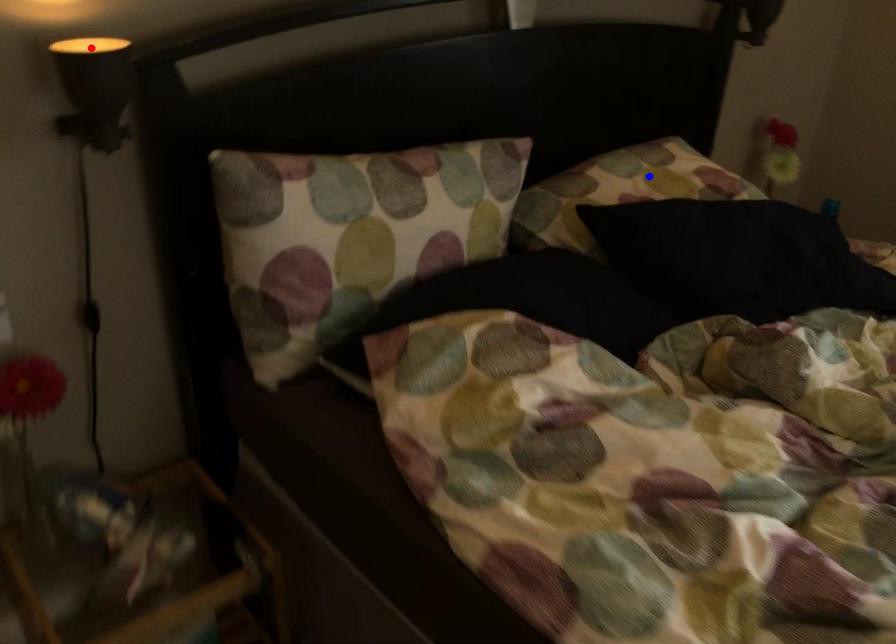
Question: Which of the two points in the image is closer to the camera?

Choices:
 (A) Blue point is closer.
 (B) Red point is closer.

Answer: (B)